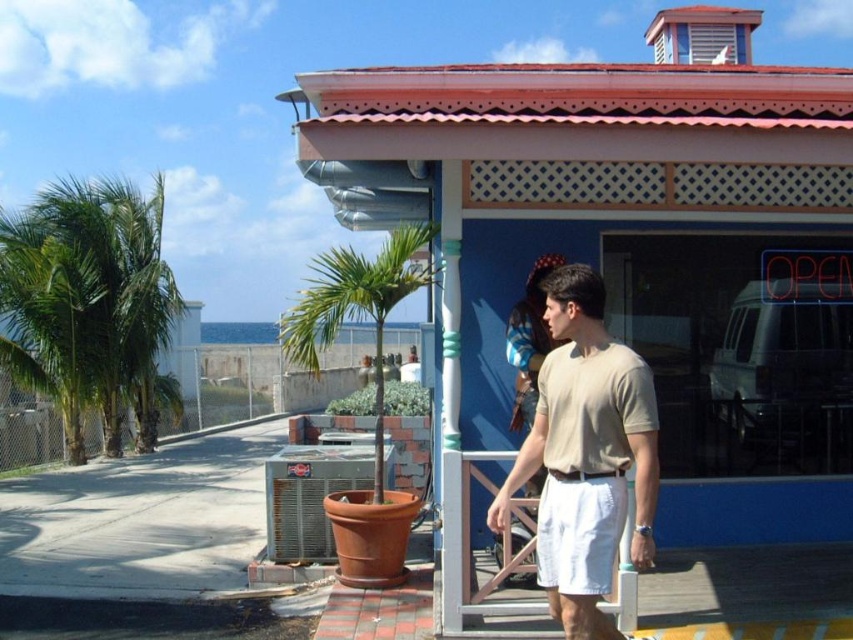
Question: Does beige cotton t-shirt at center have a lesser width compared to white cotton shorts at center?

Choices:
 (A) no
 (B) yes

Answer: (A)

Question: Can you confirm if green leafy palm tree at center is positioned above white cotton shorts at center?

Choices:
 (A) yes
 (B) no

Answer: (A)

Question: Which of the following is the farthest from the observer?

Choices:
 (A) beige cotton t-shirt at center
 (B) green leafy palm trees at left

Answer: (B)

Question: Which of the following is the closest to the observer?

Choices:
 (A) (53, 333)
 (B) (544, 561)
 (C) (657, 483)

Answer: (C)

Question: Is green leafy palm trees at left positioned before white cotton shorts at center?

Choices:
 (A) no
 (B) yes

Answer: (A)

Question: Among these objects, which one is farthest from the camera?

Choices:
 (A) green leafy palm trees at left
 (B) white cotton shorts at center

Answer: (A)